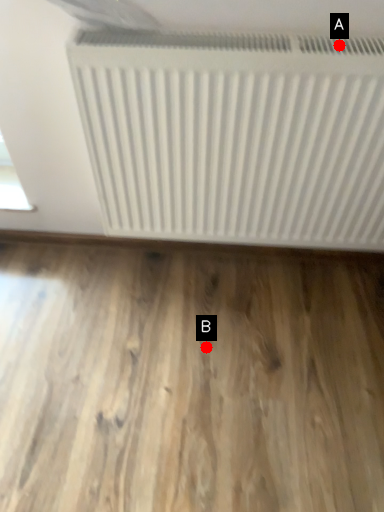
Question: Two points are circled on the image, labeled by A and B beside each circle. Among these points, which one is nearest to the camera?

Choices:
 (A) A is closer
 (B) B is closer

Answer: (A)